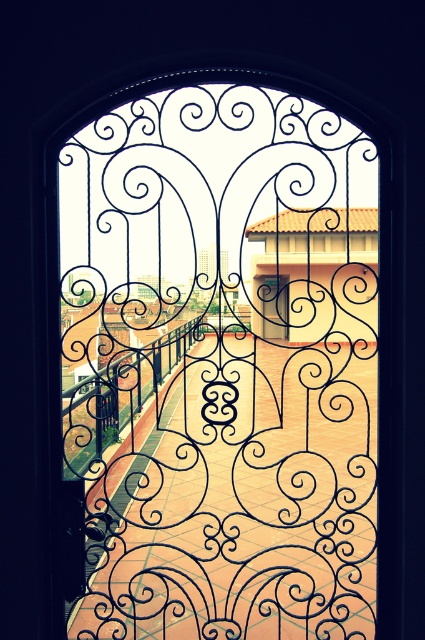
Question: Does black wrought iron gate at center have a smaller size compared to matte black door at center?

Choices:
 (A) no
 (B) yes

Answer: (B)

Question: Does black wrought iron gate at center appear on the left side of matte black door at center?

Choices:
 (A) yes
 (B) no

Answer: (B)

Question: Is black wrought iron gate at center bigger than matte black door at center?

Choices:
 (A) no
 (B) yes

Answer: (A)

Question: Which object is closer to the camera taking this photo?

Choices:
 (A) black wrought iron gate at center
 (B) matte black door at center

Answer: (B)

Question: Which of the following is the farthest from the observer?

Choices:
 (A) matte black door at center
 (B) black wrought iron gate at center

Answer: (B)